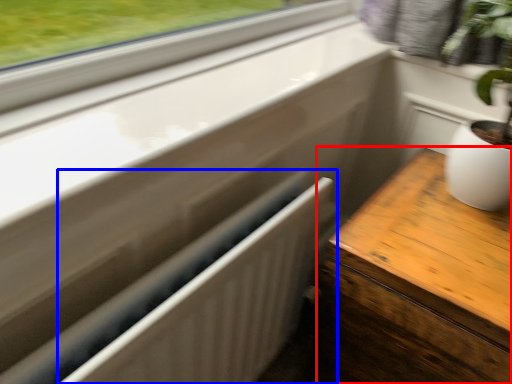
Question: Which object is closer to the camera taking this photo, table (highlighted by a red box) or radiator (highlighted by a blue box)?

Choices:
 (A) table
 (B) radiator

Answer: (B)